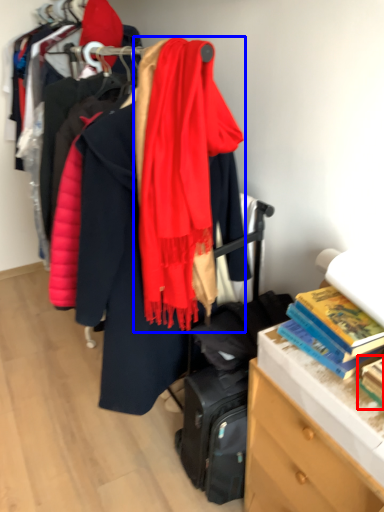
Question: Which object appears closest to the camera in this image, book (highlighted by a red box) or scarf (highlighted by a blue box)?

Choices:
 (A) book
 (B) scarf

Answer: (A)